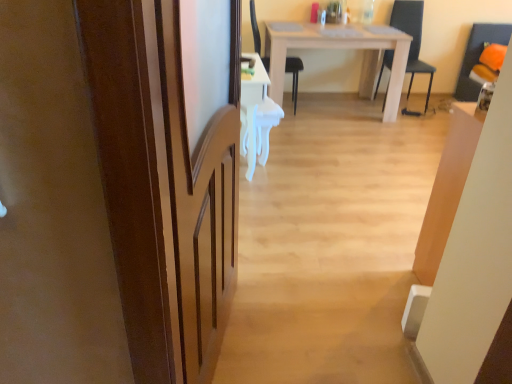
Identify the location of brown wooden screen door at left. (x=201, y=158).

Describe the element at coordinates (201, 158) in the screenshot. I see `brown wooden screen door at left` at that location.

At what (x,y) coordinates should I click in order to perform the action: click on black matte chair at center, marked as the 2th chair in a left-to-right arrangement. Please return your answer as a coordinate pair (x, y). The width and height of the screenshot is (512, 384). Looking at the image, I should click on (412, 37).

I want to click on white matte table at center, so click(341, 48).

Locate an element on the screen. The height and width of the screenshot is (384, 512). white glossy desk at center is located at coordinates (256, 116).

You are a GUI agent. You are given a task and a screenshot of the screen. Output one action in this format:
    pyautogui.click(x=<x>, y=<y>)
    Task: Click on the black plastic chair at center, which is the 2th chair in right-to-left order
    Image resolution: width=512 pixels, height=384 pixels.
    Given the screenshot: What is the action you would take?
    [294, 75]

Find the location of a particular element. brown wooden screen door at left is located at coordinates (201, 158).

Is brown wooden screen door at left spatially inside black matte chair at center, which appears as the 1th chair when viewed from the right, or outside of it?

brown wooden screen door at left exists outside the volume of black matte chair at center, which appears as the 1th chair when viewed from the right.

From the image's perspective, which one is positioned lower, brown wooden screen door at left or black matte chair at center, marked as the 2th chair in a left-to-right arrangement?

From the image's view, brown wooden screen door at left is below.

How different are the orientations of brown wooden screen door at left and black matte chair at center, marked as the 2th chair in a left-to-right arrangement, in degrees?

They differ by 81.2 degrees in their facing directions.

Which of these two, brown wooden screen door at left or black matte chair at center, which appears as the 1th chair when viewed from the right, is smaller?

With smaller size is brown wooden screen door at left.

Is brown wooden screen door at left turned away from white matte table at center?

No.

Does brown wooden screen door at left appear on the left side of white matte table at center?

Correct, you'll find brown wooden screen door at left to the left of white matte table at center.

Is brown wooden screen door at left further to the viewer compared to white matte table at center?

No, the depth of brown wooden screen door at left is less than that of white matte table at center.

Is point (215, 137) farther from viewer compared to point (394, 40)?

No, (215, 137) is in front of (394, 40).

Is black plastic chair at center, which is the 2th chair in right-to-left order, looking in the opposite direction of white matte table at center?

Correct, black plastic chair at center, which is the 2th chair in right-to-left order, is looking away from white matte table at center.

Which of these two, black plastic chair at center, the first chair in the left-to-right sequence, or white matte table at center, stands shorter?

white matte table at center.

Is there a large distance between black plastic chair at center, the first chair in the left-to-right sequence, and white matte table at center?

No.

Is black plastic chair at center, which is the 2th chair in right-to-left order, not within white matte table at center?

No.

Would you consider white matte table at center to be distant from white glossy desk at center?

That's right, there is a large distance between white matte table at center and white glossy desk at center.

Which object is positioned more to the right, white matte table at center or white glossy desk at center?

white matte table at center is more to the right.

Can you tell me how much white matte table at center and white glossy desk at center differ in facing direction?

90.4 degrees separate the facing orientations of white matte table at center and white glossy desk at center.

Which object is wider, white matte table at center or white glossy desk at center?

Wider between the two is white matte table at center.

Can you tell me how much black plastic chair at center, which is the 2th chair in right-to-left order, and white glossy desk at center differ in facing direction?

black plastic chair at center, which is the 2th chair in right-to-left order, and white glossy desk at center are facing 4.94 degrees away from each other.

Which is in front, point (267, 69) or point (275, 113)?

Positioned in front is point (275, 113).

Considering the relative sizes of black plastic chair at center, which is the 2th chair in right-to-left order, and white glossy desk at center in the image provided, is black plastic chair at center, which is the 2th chair in right-to-left order, wider than white glossy desk at center?

Correct, the width of black plastic chair at center, which is the 2th chair in right-to-left order, exceeds that of white glossy desk at center.

Is black matte chair at center, marked as the 2th chair in a left-to-right arrangement, directly adjacent to black plastic chair at center, the first chair in the left-to-right sequence?

No, black matte chair at center, marked as the 2th chair in a left-to-right arrangement, is not beside black plastic chair at center, the first chair in the left-to-right sequence.

Is black matte chair at center, marked as the 2th chair in a left-to-right arrangement, oriented towards black plastic chair at center, which is the 2th chair in right-to-left order?

No, black matte chair at center, marked as the 2th chair in a left-to-right arrangement, is not oriented towards black plastic chair at center, which is the 2th chair in right-to-left order.

Which is behind, point (411, 76) or point (257, 47)?

The point (411, 76) is farther.

From a real-world perspective, between black matte chair at center, which appears as the 1th chair when viewed from the right, and black plastic chair at center, which is the 2th chair in right-to-left order, who is vertically higher?

In real-world perspective, black plastic chair at center, which is the 2th chair in right-to-left order, is above.

Is black plastic chair at center, which is the 2th chair in right-to-left order, with black matte chair at center, which appears as the 1th chair when viewed from the right?

→ black plastic chair at center, which is the 2th chair in right-to-left order, and black matte chair at center, which appears as the 1th chair when viewed from the right, are not in contact.

From the image's perspective, which object appears higher, black plastic chair at center, which is the 2th chair in right-to-left order, or black matte chair at center, marked as the 2th chair in a left-to-right arrangement?

black matte chair at center, marked as the 2th chair in a left-to-right arrangement, from the image's perspective.

Which object is thinner, black plastic chair at center, which is the 2th chair in right-to-left order, or black matte chair at center, which appears as the 1th chair when viewed from the right?

Thinner between the two is black plastic chair at center, which is the 2th chair in right-to-left order.

Which object is more forward, black plastic chair at center, which is the 2th chair in right-to-left order, or black matte chair at center, which appears as the 1th chair when viewed from the right?

black plastic chair at center, which is the 2th chair in right-to-left order.

From a real-world perspective, which chair is the 2nd one underneath the brown wooden screen door at left? Please provide its 2D coordinates.

[(412, 37)]

Where is `screen door that is below the white matte table at center (from the image's perspective)`? This screenshot has width=512, height=384. screen door that is below the white matte table at center (from the image's perspective) is located at coordinates (201, 158).

When comparing their distances from white glossy desk at center, does brown wooden screen door at left or black matte chair at center, marked as the 2th chair in a left-to-right arrangement, seem further?

Among the two, black matte chair at center, marked as the 2th chair in a left-to-right arrangement, is located further to white glossy desk at center.

Based on their spatial positions, is brown wooden screen door at left or black plastic chair at center, the first chair in the left-to-right sequence, further from white matte table at center?

The object further to white matte table at center is brown wooden screen door at left.

Considering their positions, is black plastic chair at center, the first chair in the left-to-right sequence, positioned further to black matte chair at center, marked as the 2th chair in a left-to-right arrangement, than white matte table at center?

Among the two, black plastic chair at center, the first chair in the left-to-right sequence, is located further to black matte chair at center, marked as the 2th chair in a left-to-right arrangement.

Considering their positions, is black matte chair at center, marked as the 2th chair in a left-to-right arrangement, positioned further to brown wooden screen door at left than white matte table at center?

The object further to brown wooden screen door at left is black matte chair at center, marked as the 2th chair in a left-to-right arrangement.

When comparing their distances from black plastic chair at center, which is the 2th chair in right-to-left order, does brown wooden screen door at left or black matte chair at center, which appears as the 1th chair when viewed from the right, seem closer?

The object closer to black plastic chair at center, which is the 2th chair in right-to-left order, is black matte chair at center, which appears as the 1th chair when viewed from the right.

From the picture: When comparing their distances from white matte table at center, does black matte chair at center, marked as the 2th chair in a left-to-right arrangement, or white glossy desk at center seem closer?

black matte chair at center, marked as the 2th chair in a left-to-right arrangement, is closer to white matte table at center.

Considering their positions, is black plastic chair at center, the first chair in the left-to-right sequence, positioned closer to white matte table at center than brown wooden screen door at left?

black plastic chair at center, the first chair in the left-to-right sequence, is closer to white matte table at center.

Considering their positions, is brown wooden screen door at left positioned further to white glossy desk at center than black plastic chair at center, which is the 2th chair in right-to-left order?

brown wooden screen door at left is further to white glossy desk at center.

The height and width of the screenshot is (384, 512). What are the coordinates of `chair positioned between brown wooden screen door at left and black matte chair at center, marked as the 2th chair in a left-to-right arrangement, from near to far` in the screenshot? It's located at (294, 75).

The height and width of the screenshot is (384, 512). Identify the location of table between brown wooden screen door at left and black matte chair at center, marked as the 2th chair in a left-to-right arrangement, from front to back. (341, 48).

The image size is (512, 384). I want to click on table located between black plastic chair at center, the first chair in the left-to-right sequence, and black matte chair at center, marked as the 2th chair in a left-to-right arrangement, in the left-right direction, so click(341, 48).

The image size is (512, 384). In order to click on desk between brown wooden screen door at left and black plastic chair at center, which is the 2th chair in right-to-left order, from front to back in this screenshot , I will do `click(256, 116)`.